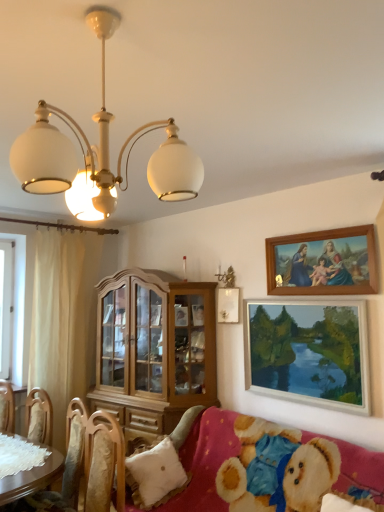
You are a GUI agent. You are given a task and a screenshot of the screen. Output one action in this format:
    pyautogui.click(x=<x>, y=<y>)
    Task: Click on the empty space that is ontop of white glossy chandelier at upper center (from a real-world perspective)
    This screenshot has width=384, height=512.
    Given the screenshot: What is the action you would take?
    pyautogui.click(x=110, y=26)